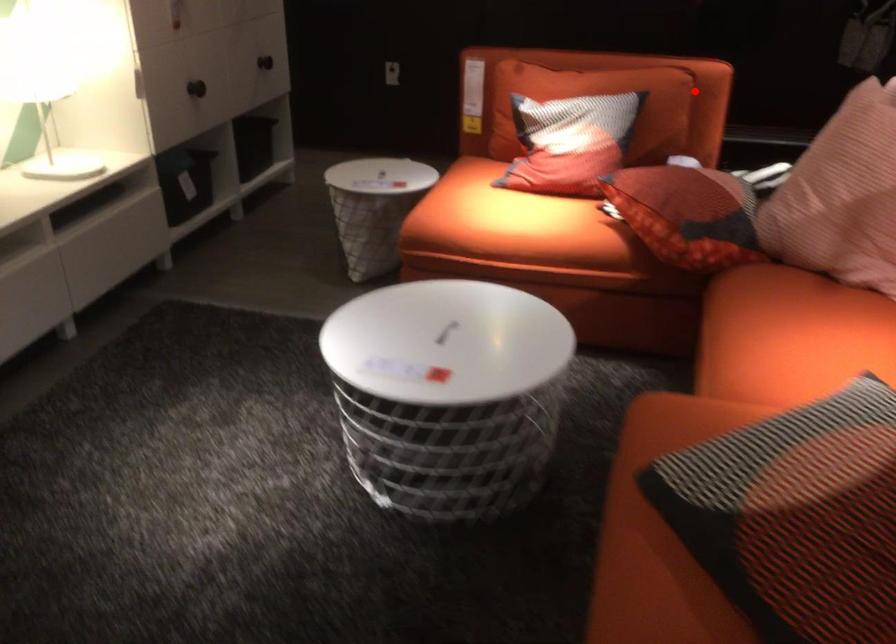
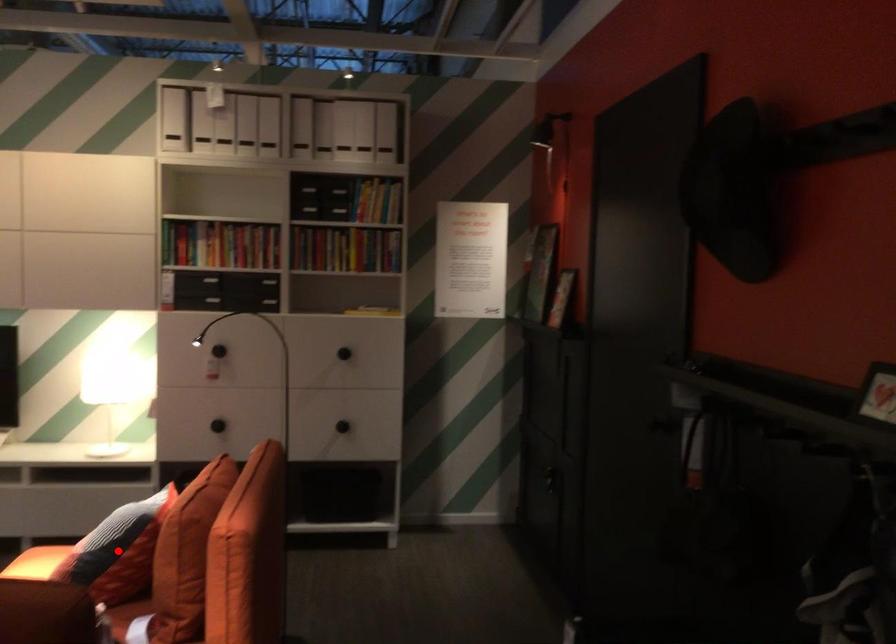
I am providing you with two images of the same scene from different viewpoints. A red point is marked on the first image and another point is marked on the second image. Do the highlighted points in image1 and image2 indicate the same real-world spot?

No